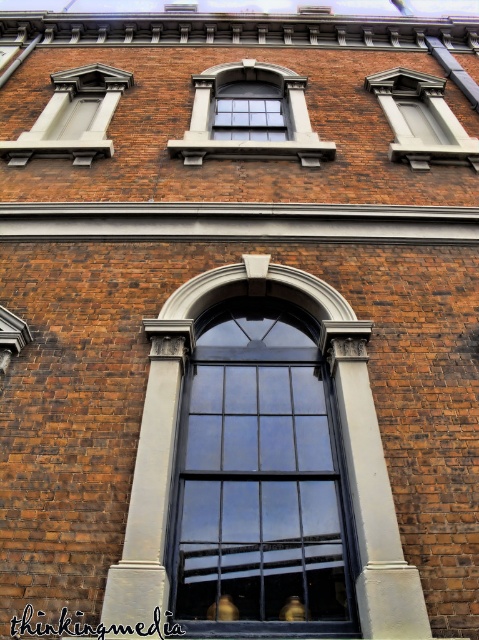
You are standing in front of the brick building and notice two points marked on the wall. The first point is at coordinates point (240, 109) and the second is at point (103, 156). Which point is closer to the viewer?

Point (103, 156) is closer to the viewer because the point (240, 109) is behind it.

You are an architect designing a new building and want to place a decorative element exactly at the center of the black glass window at center. According to the provided coordinates, where should you position it?

The black glass window at center is located at point coordinates (260, 477), so you should position the decorative element precisely at those coordinates to place it exactly at the center of the window.